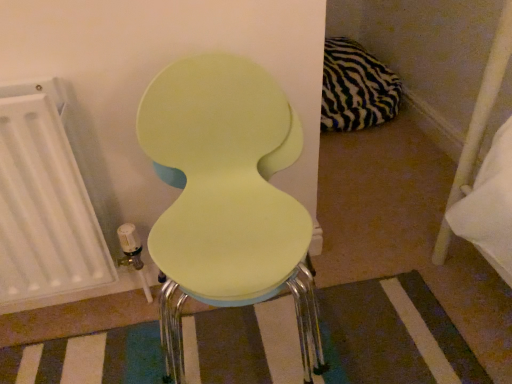
Question: Is matte green chair at center aimed at zebra-patterned fabric pillow at upper right?

Choices:
 (A) no
 (B) yes

Answer: (A)

Question: Would you say matte green chair at center contains zebra-patterned fabric pillow at upper right?

Choices:
 (A) no
 (B) yes

Answer: (A)

Question: From a real-world perspective, is matte green chair at center beneath zebra-patterned fabric pillow at upper right?

Choices:
 (A) no
 (B) yes

Answer: (A)

Question: From the image's perspective, is matte green chair at center under zebra-patterned fabric pillow at upper right?

Choices:
 (A) yes
 (B) no

Answer: (A)

Question: Is matte green chair at center smaller than zebra-patterned fabric pillow at upper right?

Choices:
 (A) yes
 (B) no

Answer: (B)

Question: Is matte yellow stool at center taller or shorter than white matte radiator at left?

Choices:
 (A) tall
 (B) short

Answer: (B)

Question: In terms of size, does matte yellow stool at center appear bigger or smaller than white matte radiator at left?

Choices:
 (A) small
 (B) big

Answer: (A)

Question: Considering the relative positions of matte yellow stool at center and white matte radiator at left in the image provided, is matte yellow stool at center to the left or to the right of white matte radiator at left?

Choices:
 (A) left
 (B) right

Answer: (B)

Question: From a real-world perspective, is matte yellow stool at center physically located above or below white matte radiator at left?

Choices:
 (A) above
 (B) below

Answer: (B)

Question: Which is correct: matte yellow stool at center is inside matte green chair at center, or outside of it?

Choices:
 (A) inside
 (B) outside

Answer: (B)

Question: Based on their sizes in the image, would you say matte yellow stool at center is bigger or smaller than matte green chair at center?

Choices:
 (A) big
 (B) small

Answer: (B)

Question: In terms of height, does matte yellow stool at center look taller or shorter compared to matte green chair at center?

Choices:
 (A) tall
 (B) short

Answer: (B)

Question: Considering the positions of matte yellow stool at center and matte green chair at center in the image, is matte yellow stool at center wider or thinner than matte green chair at center?

Choices:
 (A) wide
 (B) thin

Answer: (B)

Question: Considering the positions of white matte radiator at left and matte green chair at center in the image, is white matte radiator at left taller or shorter than matte green chair at center?

Choices:
 (A) tall
 (B) short

Answer: (B)

Question: Relative to matte green chair at center, is white matte radiator at left in front or behind?

Choices:
 (A) front
 (B) behind

Answer: (B)